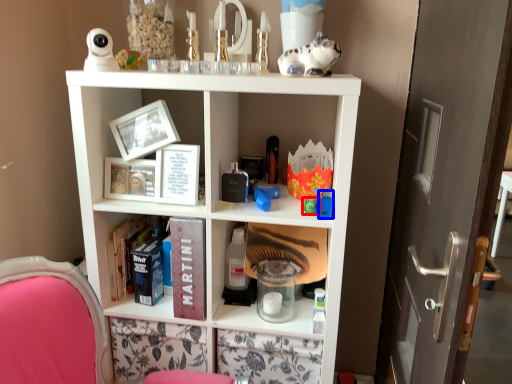
Question: Which object is closer to the camera taking this photo, toy (highlighted by a red box) or toy (highlighted by a blue box)?

Choices:
 (A) toy
 (B) toy

Answer: (A)